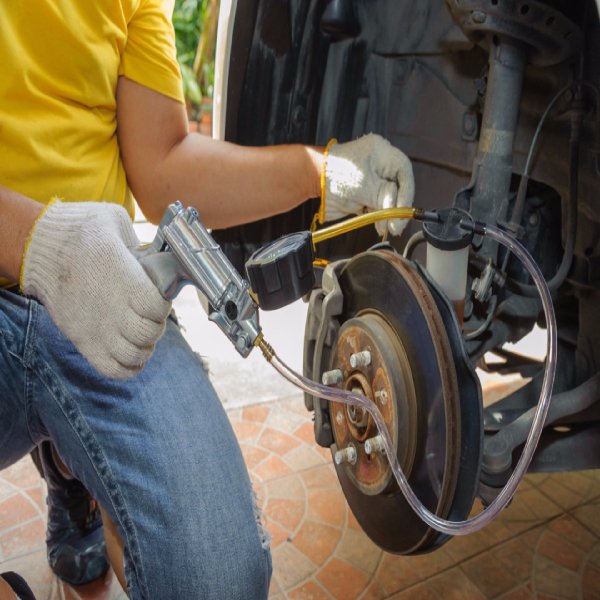
This screenshot has height=600, width=600. Identify the location of screws. (355, 365).